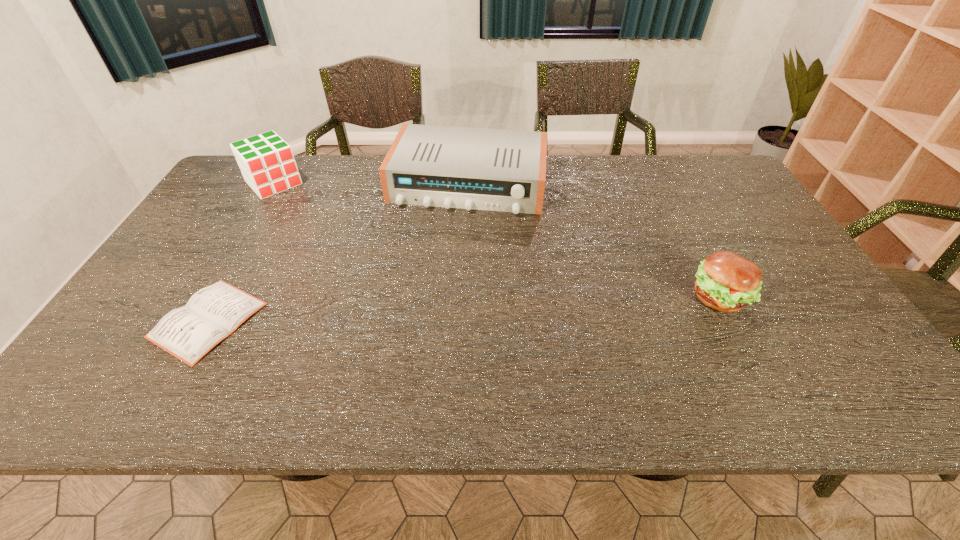
This screenshot has height=540, width=960. What are the coordinates of `diary` in the screenshot? It's located at (213, 313).

Find the location of a particular element. The image size is (960, 540). hamburger is located at coordinates (726, 282).

In order to click on radio receiver in this screenshot , I will do `click(501, 170)`.

Where is `cube`? cube is located at coordinates (267, 163).

Locate an element on the screen. The image size is (960, 540). free space located 0.060m on the left of the shortest object is located at coordinates (131, 320).

Where is `free location located 0.310m on the back of the rightmost object`? This screenshot has height=540, width=960. free location located 0.310m on the back of the rightmost object is located at coordinates (670, 204).

What are the coordinates of `free region located 0.290m on the control panel of the second object from right to left` in the screenshot? It's located at (438, 288).

This screenshot has width=960, height=540. I want to click on free space located on the control panel of the second object from right to left, so click(x=436, y=294).

You are a GUI agent. You are given a task and a screenshot of the screen. Output one action in this format:
    pyautogui.click(x=<x>, y=<y>)
    Task: Click on the vacant space positioned 0.360m on the control panel of the second object from right to left
    The width and height of the screenshot is (960, 540).
    Given the screenshot: What is the action you would take?
    pyautogui.click(x=432, y=309)

Where is `free region located on the red face of the cube`? This screenshot has height=540, width=960. free region located on the red face of the cube is located at coordinates (334, 247).